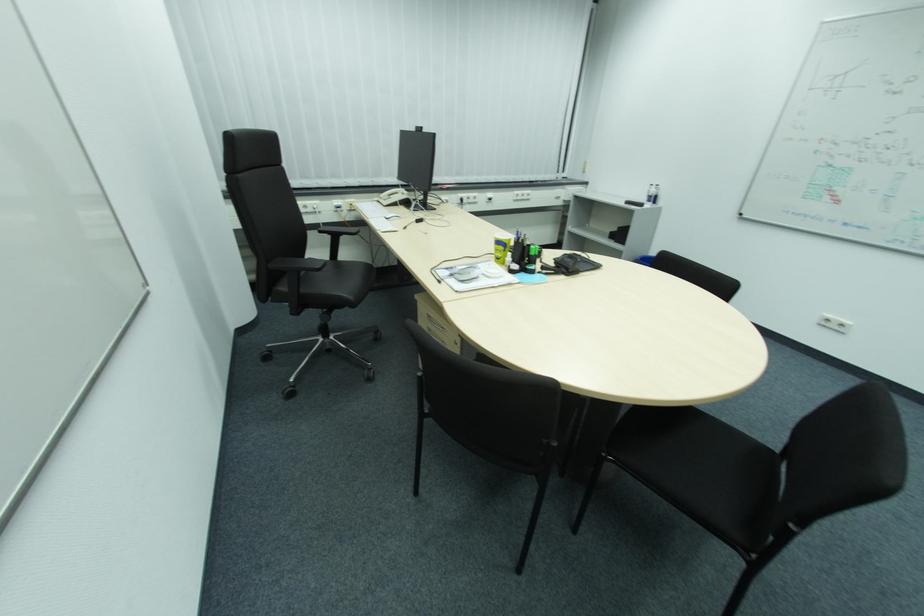
Which object does [435,275] point to?

It corresponds to the black pen in the image.